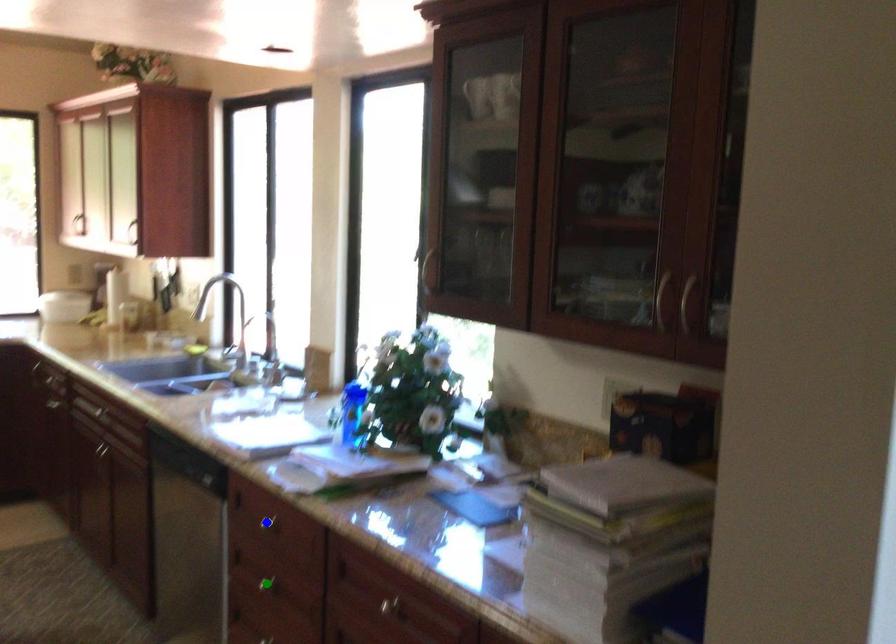
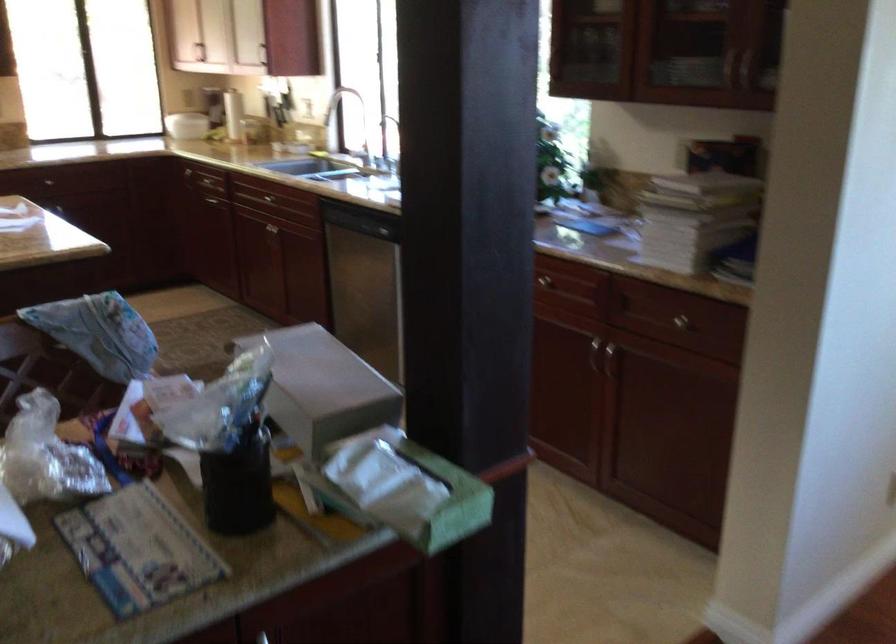
I am providing you with two images of the same scene from different viewpoints. Three points are marked in image1. Which point corresponds to a part or object that is occluded in image2?In image1, three points are marked. Which of them correspond to a part or object that is occluded in image2?Among the three points shown in image1, which one corresponds to a part or object that is no longer visible due to occlusion in image2?

yellow point, blue point, green point cannot be seen in image2.